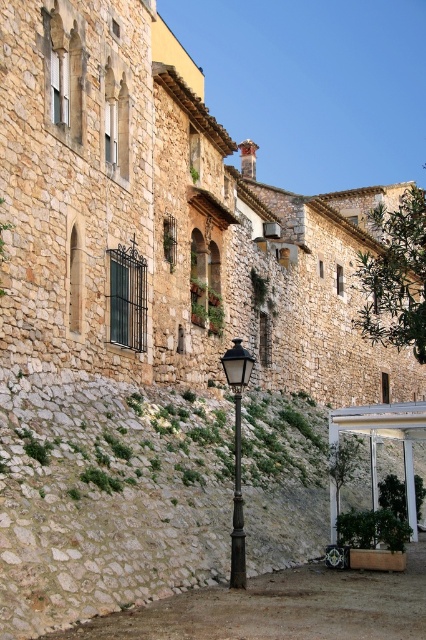
How much distance is there between rustic stone wall at center and polished bronze streetlamp at center?

rustic stone wall at center is 4.93 meters away from polished bronze streetlamp at center.

Which is in front, point (97, 442) or point (239, 556)?

Positioned in front is point (239, 556).

At what (x,y) coordinates should I click in order to perform the action: click on rustic stone wall at center. Please return your answer as a coordinate pair (x, y). The width and height of the screenshot is (426, 640). Looking at the image, I should click on (108, 499).